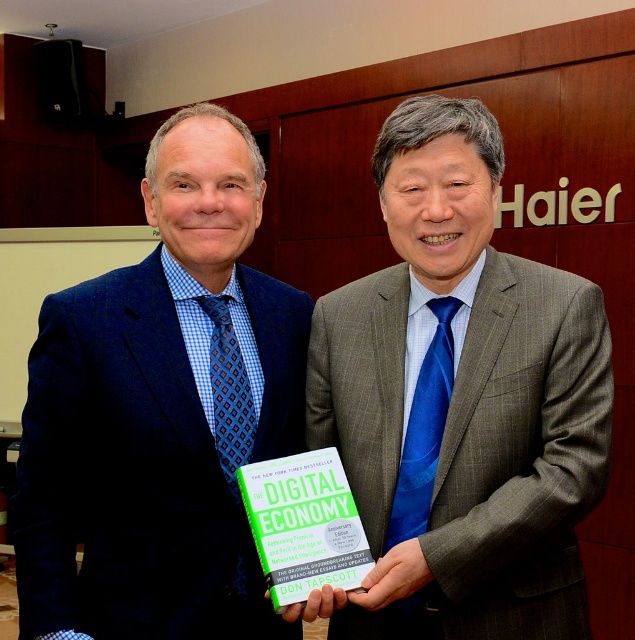
What is the 2D coordinate of the blue silk tie at center?

The blue silk tie at center is located at the 2D coordinate point of (460, 403).

You are a photographer adjusting your camera settings for a portrait of both individuals. You notice two points of interest marked at coordinates point (601, 477) and point (110, 394). Which point is closer to your camera lens?

Point (601, 477) is closer to the camera lens than point (110, 394).

Looking at this image, you are a photographer at a conference and need to capture a closeup of the blue silk tie at center and the blue checkered fabric suit at left. Which object is positioned to the right of the other?

The blue silk tie at center is to the right of the blue checkered fabric suit at left according to the description.